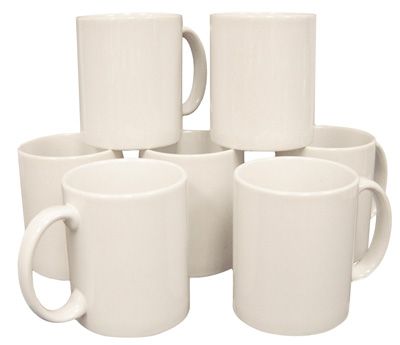
Image resolution: width=400 pixels, height=345 pixels. In order to click on mugs in this screenshot , I will do `click(86, 262)`, `click(36, 208)`, `click(105, 124)`, `click(226, 98)`, `click(200, 175)`, `click(268, 204)`, `click(325, 154)`.